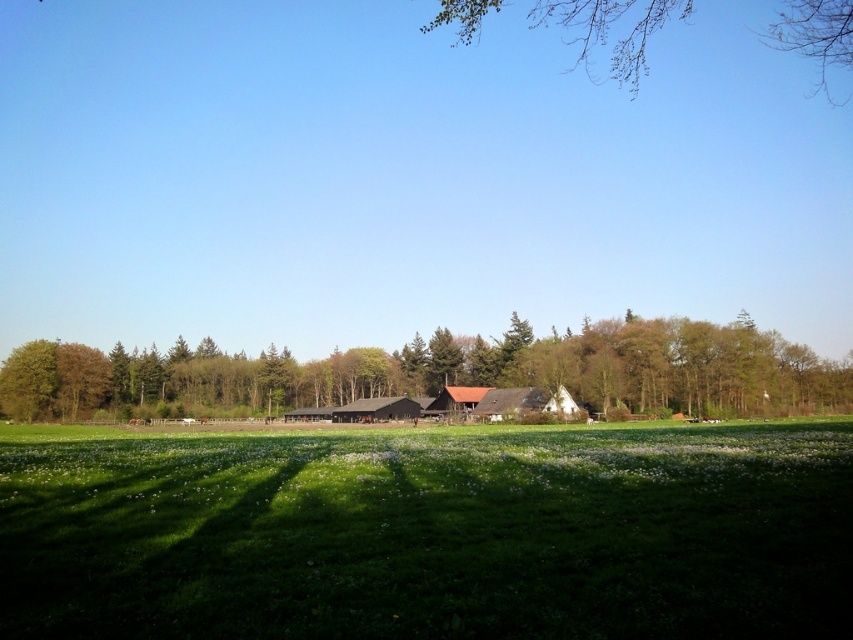
Question: Which object is positioned closest to the dark brown wooden barn at center?

Choices:
 (A) green grassy field at center
 (B) bare branches at upper center
 (C) green leafy tree at center

Answer: (C)

Question: Among these objects, which one is farthest from the camera?

Choices:
 (A) bare branches at upper center
 (B) dark brown wooden barn at center
 (C) green grassy field at center
 (D) green leafy tree at center

Answer: (B)

Question: Is bare branches at upper center positioned at the back of dark brown wooden barn at center?

Choices:
 (A) no
 (B) yes

Answer: (A)

Question: Is green grassy field at center above dark brown wooden barn at center?

Choices:
 (A) no
 (B) yes

Answer: (B)

Question: Among these objects, which one is farthest from the camera?

Choices:
 (A) bare branches at upper center
 (B) green leafy tree at center
 (C) green grassy field at center

Answer: (B)

Question: Is green grassy field at center smaller than green leafy tree at center?

Choices:
 (A) yes
 (B) no

Answer: (A)